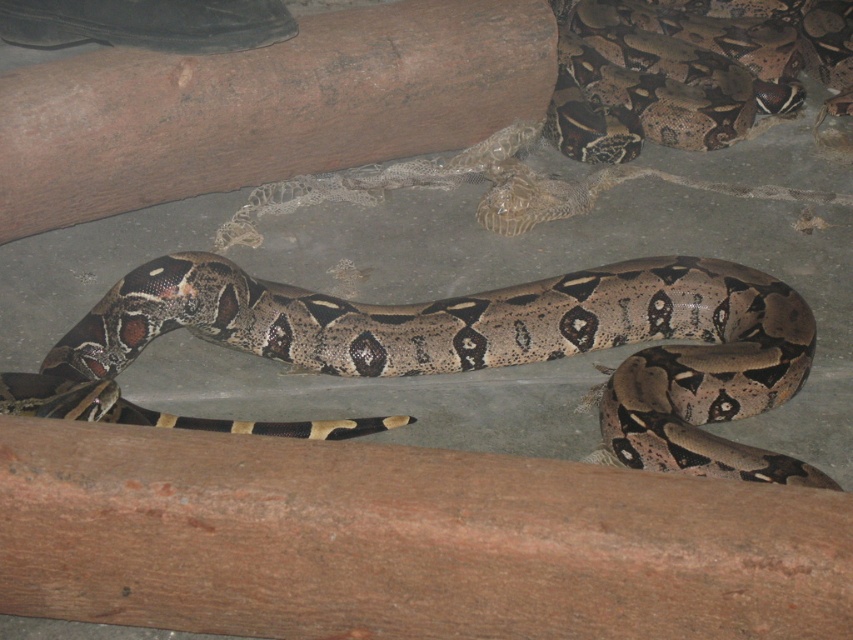
Question: Which is farther from the camouflage-patterned snake at center?

Choices:
 (A) brown textured snake at center
 (B) brown rough log at center

Answer: (A)

Question: Is camouflage-patterned snake at center to the left of brown textured snake at center from the viewer's perspective?

Choices:
 (A) no
 (B) yes

Answer: (B)

Question: Which of these objects is positioned farthest from the brown textured snake at center?

Choices:
 (A) camouflage-patterned snake at center
 (B) brown rough log at center

Answer: (A)

Question: Is brown rough log at center to the left of brown textured snake at center from the viewer's perspective?

Choices:
 (A) no
 (B) yes

Answer: (B)

Question: Which point is farther to the camera?

Choices:
 (A) camouflage-patterned snake at center
 (B) brown textured snake at center
 (C) brown rough log at center

Answer: (B)

Question: Can you confirm if brown rough log at center is smaller than brown textured snake at center?

Choices:
 (A) yes
 (B) no

Answer: (A)